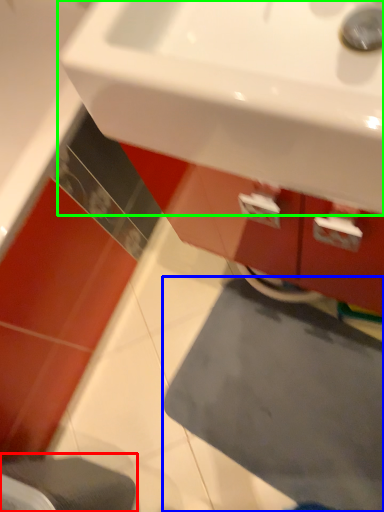
Question: Based on their relative distances, which object is farther from step stool (highlighted by a red box)? Choose from bath mat (highlighted by a blue box) and sink (highlighted by a green box).

Choices:
 (A) bath mat
 (B) sink

Answer: (B)